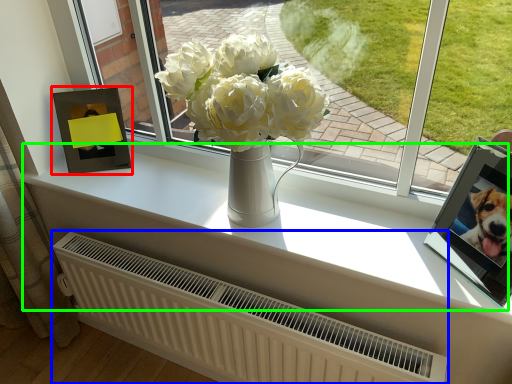
Question: Which object is the closest to the picture frame (highlighted by a red box)? Choose among these: radiator (highlighted by a blue box) or window sill (highlighted by a green box).

Choices:
 (A) radiator
 (B) window sill

Answer: (B)